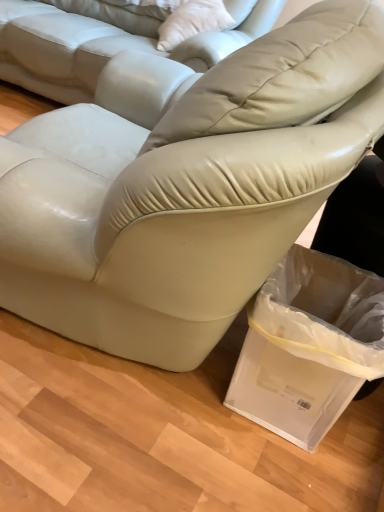
Describe the element at coordinates (187, 190) in the screenshot. I see `matte leather couch at center, the second studio couch viewed from the top` at that location.

Describe the element at coordinates (192, 22) in the screenshot. I see `white leather pillow at upper center` at that location.

Image resolution: width=384 pixels, height=512 pixels. Identify the location of white leather pillow at upper center. (192, 22).

This screenshot has height=512, width=384. Identify the location of satin beige leather couch at center, acting as the first studio couch starting from the top. (105, 42).

Where is `matte leather couch at center, positioned as the first studio couch in bottom-to-top order`? The height and width of the screenshot is (512, 384). matte leather couch at center, positioned as the first studio couch in bottom-to-top order is located at coordinates (187, 190).

From the image's perspective, would you say white leather pillow at upper center is shown under matte leather couch at center, the second studio couch viewed from the top?

Incorrect, from the image's perspective, white leather pillow at upper center is higher than matte leather couch at center, the second studio couch viewed from the top.

Is white leather pillow at upper center far from matte leather couch at center, positioned as the first studio couch in bottom-to-top order?

white leather pillow at upper center is far away from matte leather couch at center, positioned as the first studio couch in bottom-to-top order.

Could you measure the distance between white leather pillow at upper center and matte leather couch at center, positioned as the first studio couch in bottom-to-top order?

white leather pillow at upper center is 1.30 meters from matte leather couch at center, positioned as the first studio couch in bottom-to-top order.

Is white leather pillow at upper center turned away from matte leather couch at center, the second studio couch viewed from the top?

No.

Is white leather pillow at upper center oriented away from satin beige leather couch at center, acting as the first studio couch starting from the top?

Yes, white leather pillow at upper center is positioned with its back facing satin beige leather couch at center, acting as the first studio couch starting from the top.

Considering the sizes of objects white leather pillow at upper center and satin beige leather couch at center, acting as the first studio couch starting from the top, in the image provided, who is bigger, white leather pillow at upper center or satin beige leather couch at center, acting as the first studio couch starting from the top,?

satin beige leather couch at center, acting as the first studio couch starting from the top.

Looking at this image, which object is thinner, white leather pillow at upper center or satin beige leather couch at center, which is the second studio couch in bottom-to-top order?

Thinner between the two is white leather pillow at upper center.

Which point is more distant from viewer, (171, 6) or (67, 39)?

Positioned behind is point (67, 39).

Could matte leather couch at center, positioned as the first studio couch in bottom-to-top order, be considered to be inside clear plastic bag at lower right?

No, matte leather couch at center, positioned as the first studio couch in bottom-to-top order, is not surrounded by clear plastic bag at lower right.

From a real-world perspective, between clear plastic bag at lower right and matte leather couch at center, the second studio couch viewed from the top, who is vertically lower?

matte leather couch at center, the second studio couch viewed from the top.

Does clear plastic bag at lower right appear on the right side of matte leather couch at center, positioned as the first studio couch in bottom-to-top order?

Yes.

At what (x,y) coordinates should I click in order to perform the action: click on throw pillow above the clear plastic bag at lower right (from a real-world perspective). Please return your answer as a coordinate pair (x, y). Looking at the image, I should click on (192, 22).

Consider the image. Is clear plastic bag at lower right inside or outside of white leather pillow at upper center?

clear plastic bag at lower right is spatially situated outside white leather pillow at upper center.

From the picture: Which is more to the right, clear plastic bag at lower right or white leather pillow at upper center?

clear plastic bag at lower right is more to the right.

In the image, is clear plastic bag at lower right positioned in front of or behind white leather pillow at upper center?

Clearly, clear plastic bag at lower right is in front of white leather pillow at upper center.

Locate an element on the screen. The image size is (384, 512). studio couch on the right of satin beige leather couch at center, which is the second studio couch in bottom-to-top order is located at coordinates (187, 190).

Is matte leather couch at center, the second studio couch viewed from the top, behind satin beige leather couch at center, which is the second studio couch in bottom-to-top order?

No, matte leather couch at center, the second studio couch viewed from the top, is in front of satin beige leather couch at center, which is the second studio couch in bottom-to-top order.

From a real-world perspective, is matte leather couch at center, positioned as the first studio couch in bottom-to-top order, positioned over satin beige leather couch at center, which is the second studio couch in bottom-to-top order, based on gravity?

Actually, matte leather couch at center, positioned as the first studio couch in bottom-to-top order, is physically below satin beige leather couch at center, which is the second studio couch in bottom-to-top order, in the real world.

Considering the positions of objects clear plastic bag at lower right and satin beige leather couch at center, which is the second studio couch in bottom-to-top order, in the image provided, who is behind, clear plastic bag at lower right or satin beige leather couch at center, which is the second studio couch in bottom-to-top order,?

satin beige leather couch at center, which is the second studio couch in bottom-to-top order, is further away from the camera.

Is satin beige leather couch at center, which is the second studio couch in bottom-to-top order, at the back of clear plastic bag at lower right?

No, clear plastic bag at lower right's orientation is not away from satin beige leather couch at center, which is the second studio couch in bottom-to-top order.

Does clear plastic bag at lower right have a greater height compared to satin beige leather couch at center, acting as the first studio couch starting from the top?

Incorrect, the height of clear plastic bag at lower right is not larger of that of satin beige leather couch at center, acting as the first studio couch starting from the top.

Would you say clear plastic bag at lower right is inside or outside satin beige leather couch at center, which is the second studio couch in bottom-to-top order?

clear plastic bag at lower right exists outside the volume of satin beige leather couch at center, which is the second studio couch in bottom-to-top order.

Measure the distance between satin beige leather couch at center, acting as the first studio couch starting from the top, and clear plastic bag at lower right.

The distance of satin beige leather couch at center, acting as the first studio couch starting from the top, from clear plastic bag at lower right is 1.45 meters.

Find the location of a particular element. shopping bag lying on the right of satin beige leather couch at center, acting as the first studio couch starting from the top is located at coordinates (309, 345).

From the image's perspective, does satin beige leather couch at center, acting as the first studio couch starting from the top, appear higher than clear plastic bag at lower right?

Yes.

Which object is further away from the camera, satin beige leather couch at center, which is the second studio couch in bottom-to-top order, or clear plastic bag at lower right?

satin beige leather couch at center, which is the second studio couch in bottom-to-top order, is behind.

You are a GUI agent. You are given a task and a screenshot of the screen. Output one action in this format:
    pyautogui.click(x=<x>, y=<y>)
    Task: Click on the 1st studio couch counting from the left of the white leather pillow at upper center
    The height and width of the screenshot is (512, 384).
    Given the screenshot: What is the action you would take?
    pyautogui.click(x=187, y=190)

This screenshot has width=384, height=512. What are the coordinates of `throw pillow that is on the right side of satin beige leather couch at center, acting as the first studio couch starting from the top` in the screenshot? It's located at (192, 22).

Which object lies further to the anchor point white leather pillow at upper center, matte leather couch at center, positioned as the first studio couch in bottom-to-top order, or clear plastic bag at lower right?

clear plastic bag at lower right is further to white leather pillow at upper center.

When comparing their distances from white leather pillow at upper center, does clear plastic bag at lower right or matte leather couch at center, positioned as the first studio couch in bottom-to-top order, seem closer?

Based on the image, matte leather couch at center, positioned as the first studio couch in bottom-to-top order, appears to be nearer to white leather pillow at upper center.

Estimate the real-world distances between objects in this image. Which object is further from clear plastic bag at lower right, matte leather couch at center, the second studio couch viewed from the top, or satin beige leather couch at center, which is the second studio couch in bottom-to-top order?

The object further to clear plastic bag at lower right is satin beige leather couch at center, which is the second studio couch in bottom-to-top order.

Looking at the image, which one is located further to white leather pillow at upper center, satin beige leather couch at center, which is the second studio couch in bottom-to-top order, or clear plastic bag at lower right?

The object further to white leather pillow at upper center is clear plastic bag at lower right.

From the image, which object appears to be nearer to matte leather couch at center, the second studio couch viewed from the top, satin beige leather couch at center, acting as the first studio couch starting from the top, or clear plastic bag at lower right?

clear plastic bag at lower right.

In the scene shown: Estimate the real-world distances between objects in this image. Which object is closer to white leather pillow at upper center, clear plastic bag at lower right or satin beige leather couch at center, which is the second studio couch in bottom-to-top order?

Among the two, satin beige leather couch at center, which is the second studio couch in bottom-to-top order, is located nearer to white leather pillow at upper center.

Estimate the real-world distances between objects in this image. Which object is further from clear plastic bag at lower right, white leather pillow at upper center or satin beige leather couch at center, acting as the first studio couch starting from the top?

Based on the image, satin beige leather couch at center, acting as the first studio couch starting from the top, appears to be further to clear plastic bag at lower right.

Which object lies nearer to the anchor point clear plastic bag at lower right, satin beige leather couch at center, which is the second studio couch in bottom-to-top order, or matte leather couch at center, the second studio couch viewed from the top?

matte leather couch at center, the second studio couch viewed from the top, is positioned closer to the anchor clear plastic bag at lower right.

Where is `studio couch between satin beige leather couch at center, which is the second studio couch in bottom-to-top order, and clear plastic bag at lower right, in the vertical direction`? studio couch between satin beige leather couch at center, which is the second studio couch in bottom-to-top order, and clear plastic bag at lower right, in the vertical direction is located at coordinates (187, 190).

Identify the location of studio couch that lies between white leather pillow at upper center and clear plastic bag at lower right from top to bottom. (187, 190).

You are a GUI agent. You are given a task and a screenshot of the screen. Output one action in this format:
    pyautogui.click(x=<x>, y=<y>)
    Task: Click on the throw pillow between satin beige leather couch at center, which is the second studio couch in bottom-to-top order, and clear plastic bag at lower right vertically
    This screenshot has height=512, width=384.
    Given the screenshot: What is the action you would take?
    pyautogui.click(x=192, y=22)

Locate an element on the screen. studio couch located between matte leather couch at center, the second studio couch viewed from the top, and white leather pillow at upper center in the depth direction is located at coordinates pyautogui.click(x=105, y=42).